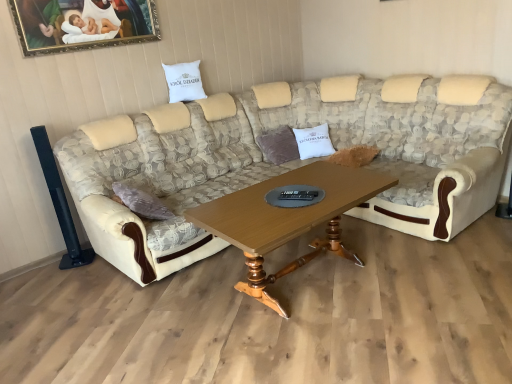
Question: Choose the correct answer: Is white cotton pillow at center, placed as the second pillow when sorted from top to bottom, inside white fabric pillow at upper center, which ranks as the 2th pillow in bottom-to-top order, or outside it?

Choices:
 (A) outside
 (B) inside

Answer: (A)

Question: Is white cotton pillow at center, placed as the 1th pillow when sorted from right to left, in front of or behind white fabric pillow at upper center, which ranks as the first pillow in left-to-right order, in the image?

Choices:
 (A) front
 (B) behind

Answer: (B)

Question: Based on their relative distances, which object is nearer to the white cotton pillow at center, placed as the second pillow when sorted from top to bottom?

Choices:
 (A) woodenwoodencoffee table at center
 (B) white fabric pillow at upper center, which ranks as the first pillow in left-to-right order
 (C) beige fabric couch at center
 (D) gold-framed painting at upper left

Answer: (C)

Question: Which object is the closest to the beige fabric couch at center?

Choices:
 (A) gold-framed painting at upper left
 (B) white fabric pillow at upper center, the 1th pillow when ordered from top to bottom
 (C) woodenwoodencoffee table at center
 (D) white cotton pillow at center, placed as the 1th pillow when sorted from right to left

Answer: (C)